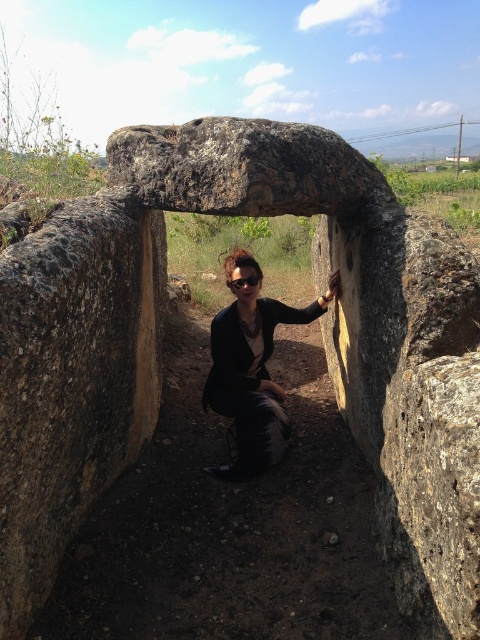
You are a photographer trying to capture a clear photo of both the matte black jacket at center and the black matte goggles at center. Since the camera can only focus on one object at a time, which object should you focus on first to ensure the other remains in the background?

You should focus on the matte black jacket at center first because it is closer to the viewer, and the black matte goggles at center will naturally be in the background.

You are a photographer trying to fit both the matte black jacket at center and the black matte goggles at center into a rectangular frame. Which object should you adjust the frame size for to ensure both fit without overlapping?

The matte black jacket at center is wider than the black matte goggles at center, so you should adjust the frame to accommodate the width of the matte black jacket at center first.